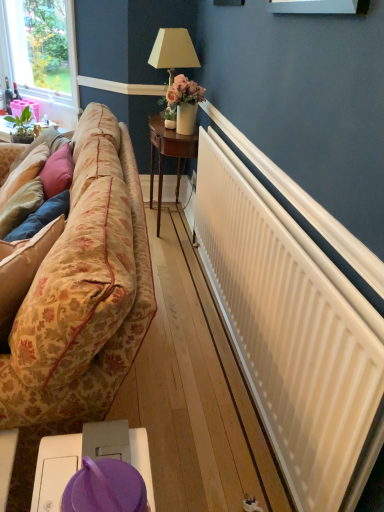
Question: Considering the relative sizes of purple fabric at lower center, the first table positioned from the front, and floral fabric couch at left in the image provided, is purple fabric at lower center, the first table positioned from the front, bigger than floral fabric couch at left?

Choices:
 (A) no
 (B) yes

Answer: (A)

Question: Can you see purple fabric at lower center, marked as the first table in a bottom-to-top arrangement, touching floral fabric couch at left?

Choices:
 (A) yes
 (B) no

Answer: (B)

Question: Does purple fabric at lower center, the first table positioned from the front, have a smaller size compared to floral fabric couch at left?

Choices:
 (A) no
 (B) yes

Answer: (B)

Question: Is purple fabric at lower center, the first table positioned from the front, at the left side of floral fabric couch at left?

Choices:
 (A) no
 (B) yes

Answer: (A)

Question: Could you tell me if purple fabric at lower center, positioned as the 3th table in back-to-front order, is facing floral fabric couch at left?

Choices:
 (A) yes
 (B) no

Answer: (B)

Question: Is purple fabric at lower center, the first table positioned from the front, positioned beyond the bounds of floral fabric couch at left?

Choices:
 (A) no
 (B) yes

Answer: (B)

Question: Is floral fabric couch at left at the left side of purple fabric at lower center, the first table positioned from the front?

Choices:
 (A) yes
 (B) no

Answer: (A)

Question: From a real-world perspective, is floral fabric couch at left on top of purple fabric at lower center, the 3th table positioned from the top?

Choices:
 (A) no
 (B) yes

Answer: (A)

Question: Does floral fabric couch at left have a larger size compared to purple fabric at lower center, the first table positioned from the front?

Choices:
 (A) yes
 (B) no

Answer: (A)

Question: Does floral fabric couch at left appear on the right side of purple fabric at lower center, positioned as the 3th table in back-to-front order?

Choices:
 (A) yes
 (B) no

Answer: (B)

Question: Would you say floral fabric couch at left is a long distance from purple fabric at lower center, the 3th table positioned from the top?

Choices:
 (A) yes
 (B) no

Answer: (B)

Question: From the image's perspective, is floral fabric couch at left beneath purple fabric at lower center, marked as the first table in a bottom-to-top arrangement?

Choices:
 (A) no
 (B) yes

Answer: (A)

Question: Does white matte radiator at right have a greater width compared to floral fabric couch at left?

Choices:
 (A) no
 (B) yes

Answer: (A)